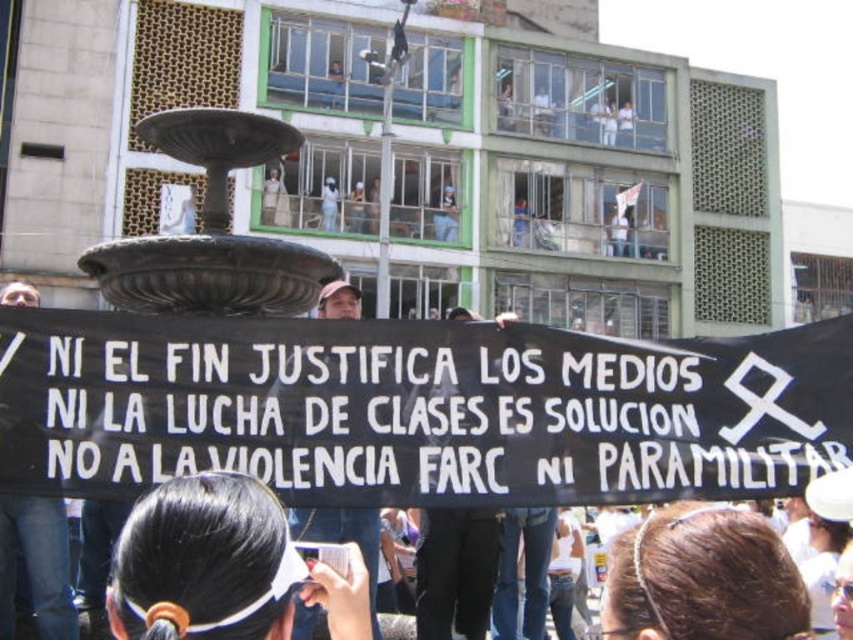
Question: Which point is closer to the camera taking this photo?

Choices:
 (A) (218, 579)
 (B) (184, 307)

Answer: (A)

Question: Which of the following is the closest to the observer?

Choices:
 (A) bronze textured fountain at center
 (B) black hair at center

Answer: (B)

Question: Considering the relative positions of black hair at center and bronze textured fountain at center in the image provided, where is black hair at center located with respect to bronze textured fountain at center?

Choices:
 (A) below
 (B) above

Answer: (A)

Question: Among these points, which one is farthest from the camera?

Choices:
 (A) (363, 582)
 (B) (178, 120)

Answer: (B)

Question: Does black hair at center have a greater width compared to bronze textured fountain at center?

Choices:
 (A) yes
 (B) no

Answer: (B)

Question: Can you confirm if black hair at center is positioned to the right of bronze textured fountain at center?

Choices:
 (A) no
 (B) yes

Answer: (B)